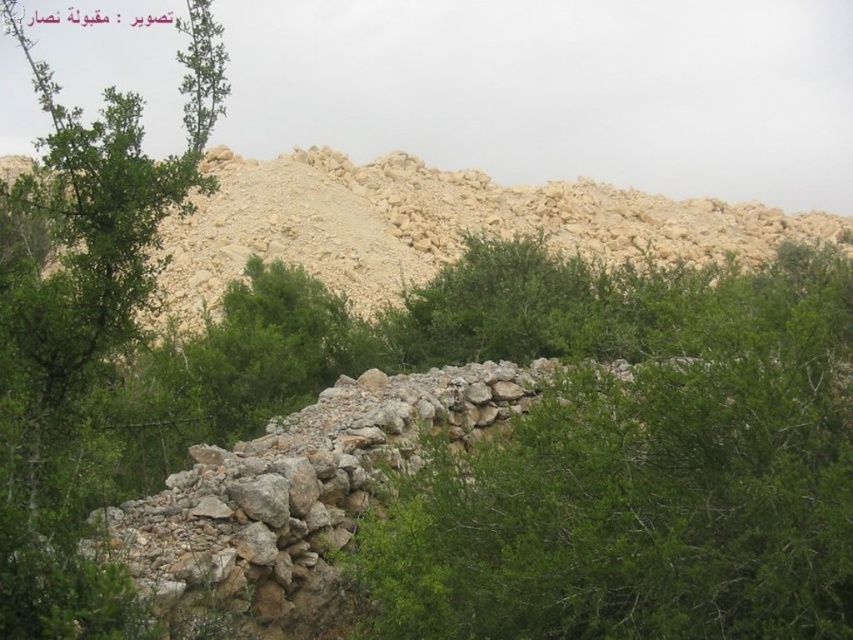
You are a hiker trying to navigate through the green leafy shrub at center and the beige stone hillside at upper center. Which object is closer to the ground?

The green leafy shrub at center is closer to the ground because it is positioned under the beige stone hillside at upper center.

You are standing in the natural landscape described and want to reach the dense cluster of green shrubs and small trees mentioned in the scene. From your current position, which direction should you move to get closer to the green leafy shrub at center?

The green leafy shrub at center is located at point (x=635, y=460), which would be towards the lower right of the image. Therefore, you should move towards the lower right direction to get closer to the green leafy shrub at center.

You are a hiker trying to reach the beige stone hillside at upper center. There is a green leafy shrub at center blocking your path. Can you walk through the shrub to get to the hillside?

The green leafy shrub at center is in front of the beige stone hillside at upper center, so you can walk through the shrub to reach the hillside behind it.